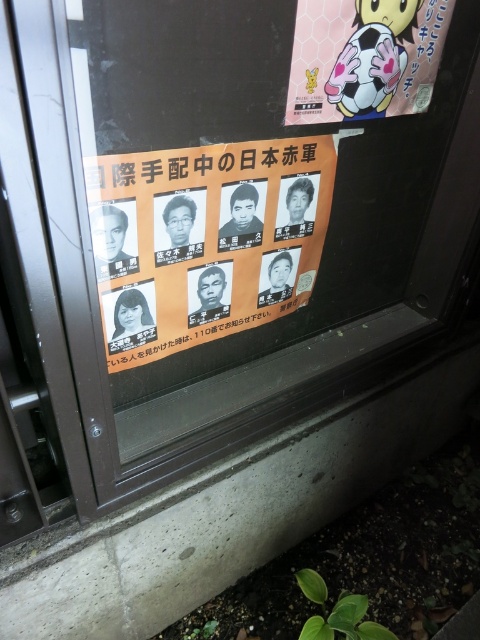
Question: Among these points, which one is nearest to the camera?

Choices:
 (A) pyautogui.click(x=295, y=84)
 (B) pyautogui.click(x=284, y=291)

Answer: (A)

Question: Can you confirm if orange paper poster at center is smaller than matte pink soccer ball at upper right?

Choices:
 (A) yes
 (B) no

Answer: (B)

Question: Does orange paper poster at center appear under matte pink soccer ball at upper right?

Choices:
 (A) no
 (B) yes

Answer: (B)

Question: Can you confirm if orange paper poster at center is positioned above matte pink soccer ball at upper right?

Choices:
 (A) no
 (B) yes

Answer: (A)

Question: Which object is farther from the camera taking this photo?

Choices:
 (A) orange paper poster at center
 (B) matte pink soccer ball at upper right

Answer: (B)